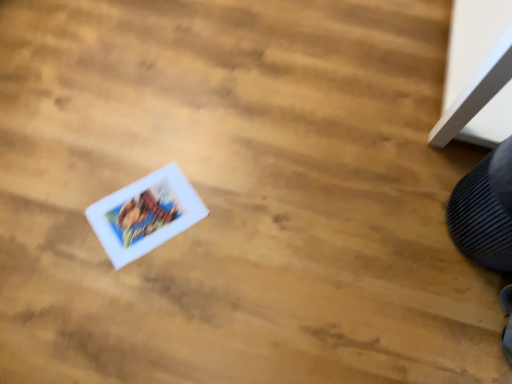
This screenshot has height=384, width=512. What are the coordinates of `free spot above white matte comic book at center (from a real-world perspective)` in the screenshot? It's located at (149, 210).